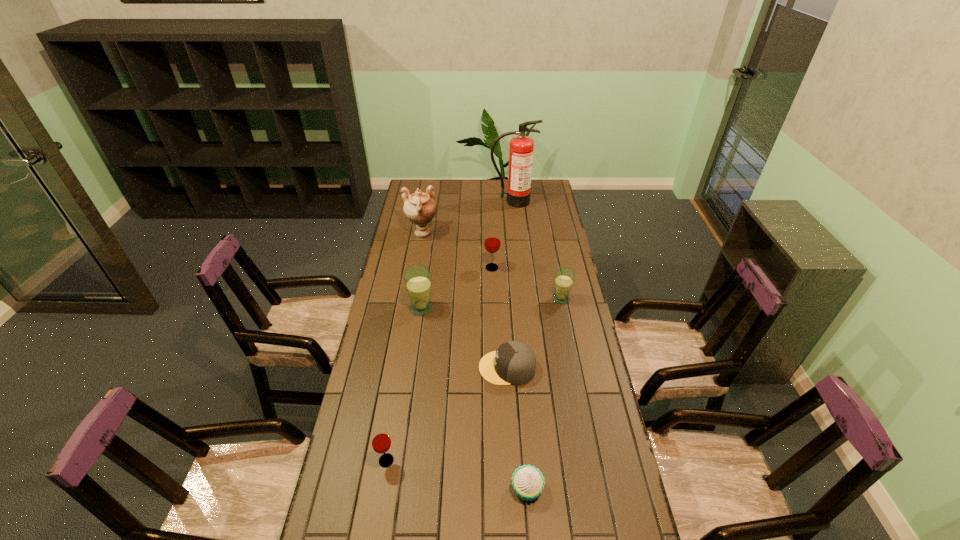
Identify the location of vacant space at the far edge of the desktop. (473, 193).

In the image, there is a desktop. Where is `vacant area at the left edge`? vacant area at the left edge is located at coordinates (402, 287).

In the image, there is a desktop. At what (x,y) coordinates should I click in order to perform the action: click on vacant area at the right edge. Please return your answer as a coordinate pair (x, y). Looking at the image, I should click on (550, 278).

This screenshot has height=540, width=960. In the image, there is a desktop. In order to click on vacant space at the far left corner in this screenshot , I will do pos(422,186).

This screenshot has height=540, width=960. In order to click on vacant area at the far right corner of the desktop in this screenshot , I will do click(532, 184).

What are the coordinates of `vacant area that lies between the nearest object and the left blue glass` in the screenshot? It's located at (474, 398).

I want to click on vacant area that lies between the rightmost glass and the right red glass, so click(x=526, y=283).

Where is `vacant space that is in between the farthest object and the second nearest object`? The image size is (960, 540). vacant space that is in between the farthest object and the second nearest object is located at coordinates (449, 331).

I want to click on free area in between the gray cap and the smaller red glass, so click(x=446, y=414).

The image size is (960, 540). I want to click on unoccupied position between the left blue glass and the tallest object, so click(467, 255).